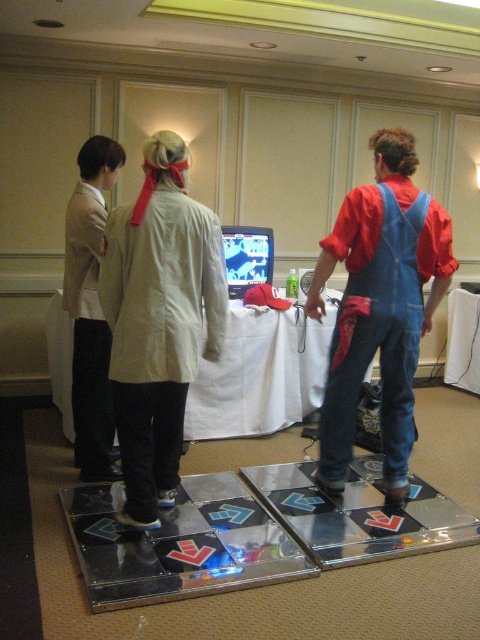
Does light beige fabric coat at center appear on the left side of denim overalls at center?

Indeed, light beige fabric coat at center is positioned on the left side of denim overalls at center.

Who is shorter, light beige fabric coat at center or denim overalls at center?

With less height is light beige fabric coat at center.

Between point (121, 209) and point (343, 452), which one is positioned behind?

The point (343, 452) is behind.

Find the location of a particular element. The height and width of the screenshot is (640, 480). light beige fabric coat at center is located at coordinates (158, 321).

Does denim overalls at center have a lesser width compared to white cloth table at center?

Yes.

Does point (363, 368) lie behind point (213, 426)?

No, (363, 368) is closer to viewer.

You are a GUI agent. You are given a task and a screenshot of the screen. Output one action in this format:
    pyautogui.click(x=<x>, y=<y>)
    Task: Click on the denim overalls at center
    Image resolution: width=480 pixels, height=640 pixels.
    Given the screenshot: What is the action you would take?
    pyautogui.click(x=380, y=305)

Does denim overalls at center appear over light beige fabric jacket at left?

No, denim overalls at center is not above light beige fabric jacket at left.

This screenshot has height=640, width=480. Describe the element at coordinates (380, 305) in the screenshot. I see `denim overalls at center` at that location.

Does point (386, 186) come farther from viewer compared to point (116, 173)?

No.

At what (x,y) coordinates should I click in order to perform the action: click on denim overalls at center. Please return your answer as a coordinate pair (x, y). Looking at the image, I should click on (380, 305).